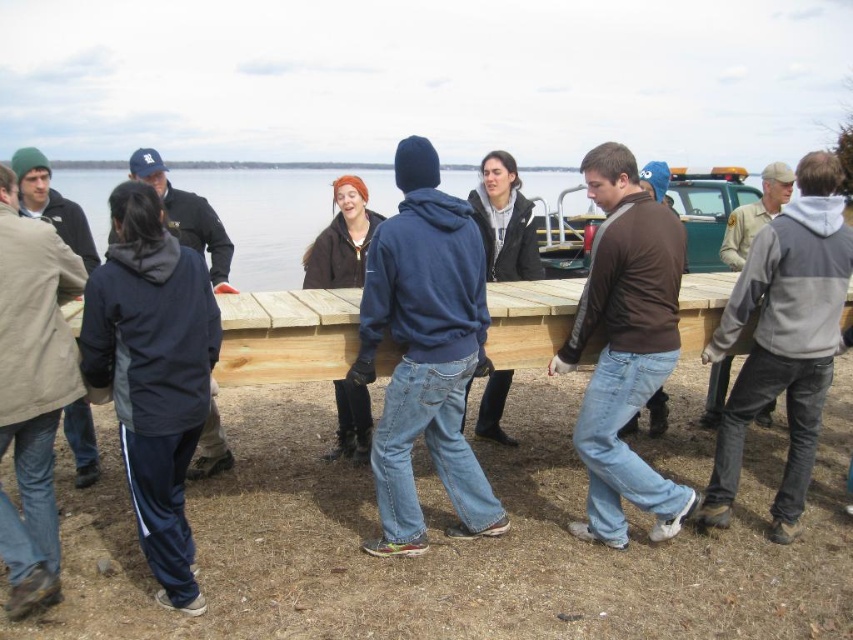
This screenshot has height=640, width=853. What do you see at coordinates (51, 204) in the screenshot? I see `beige woolen jacket at left` at bounding box center [51, 204].

Is beige woolen jacket at left shorter than khaki uniform shirt at right?

Indeed, beige woolen jacket at left has a lesser height compared to khaki uniform shirt at right.

I want to click on beige woolen jacket at left, so click(51, 204).

Is dark blue track suit at lower left positioned before gray/white hoodie at right?

That is True.

Consider the image. Which of these two, dark blue track suit at lower left or gray/white hoodie at right, stands shorter?

dark blue track suit at lower left

Is point (152, 451) positioned behind point (790, 442)?

No, (152, 451) is in front of (790, 442).

I want to click on dark blue track suit at lower left, so click(x=154, y=372).

Does dark gray fleece jacket at center have a greater height compared to khaki uniform shirt at right?

Indeed, dark gray fleece jacket at center has a greater height compared to khaki uniform shirt at right.

Who is lower down, dark gray fleece jacket at center or khaki uniform shirt at right?

dark gray fleece jacket at center is below.

Which is in front, point (471, 189) or point (737, 208)?

Point (471, 189)

You are a GUI agent. You are given a task and a screenshot of the screen. Output one action in this format:
    pyautogui.click(x=<x>, y=<y>)
    Task: Click on the dark gray fleece jacket at center
    The height and width of the screenshot is (640, 853).
    Given the screenshot: What is the action you would take?
    pyautogui.click(x=503, y=220)